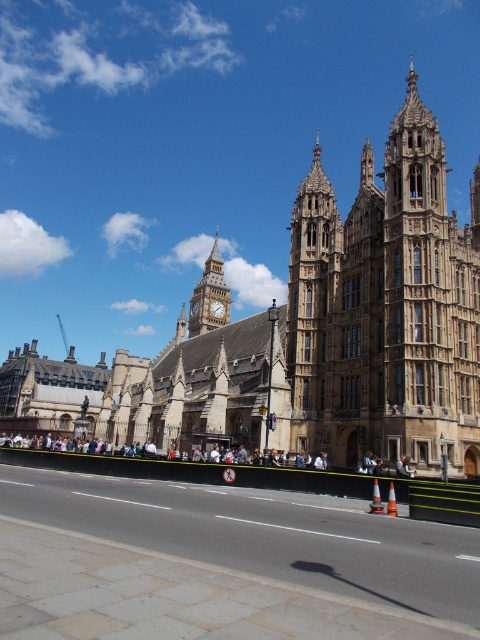
Question: Can you confirm if stone tower at upper right is positioned above brown stone tower at center?

Choices:
 (A) yes
 (B) no

Answer: (B)

Question: Considering the real-world distances, which object is closest to the brown stone building at center?

Choices:
 (A) stone tower at upper right
 (B) golden stone clock tower at center
 (C) brown stone tower at center

Answer: (C)

Question: Is brown stone tower at center closer to camera compared to golden stone clock tower at center?

Choices:
 (A) no
 (B) yes

Answer: (B)

Question: Which point is closer to the camera?

Choices:
 (A) stone tower at upper right
 (B) brown stone tower at center
 (C) golden stone clock tower at center
 (D) brown stone building at center

Answer: (D)

Question: Observing the image, what is the correct spatial positioning of stone tower at upper right in reference to brown stone tower at center?

Choices:
 (A) above
 (B) below

Answer: (B)

Question: Which object appears farthest from the camera in this image?

Choices:
 (A) stone tower at upper right
 (B) golden stone clock tower at center

Answer: (B)